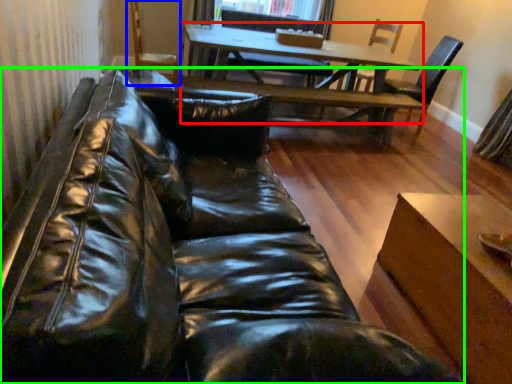
Question: Which object is the closest to the table (highlighted by a red box)? Choose among these: armchair (highlighted by a blue box) or studio couch (highlighted by a green box).

Choices:
 (A) armchair
 (B) studio couch

Answer: (A)